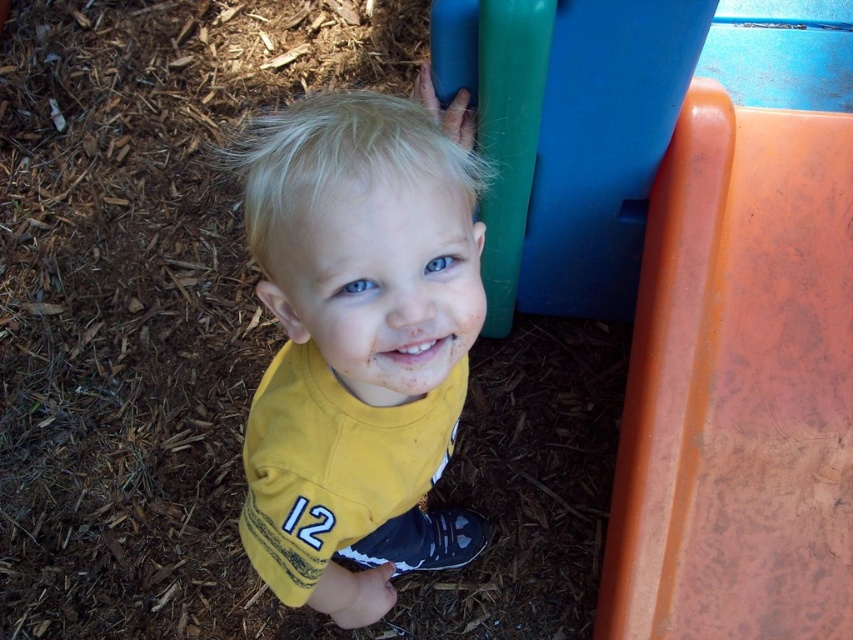
Who is positioned more to the right, orange matte slide at right or yellow fabric shirt at center?

Positioned to the right is orange matte slide at right.

Can you confirm if orange matte slide at right is taller than yellow fabric shirt at center?

Yes.

Which is behind, point (764, 179) or point (265, 582)?

The point (764, 179) is behind.

Where is `orange matte slide at right`? The image size is (853, 640). orange matte slide at right is located at coordinates (738, 387).